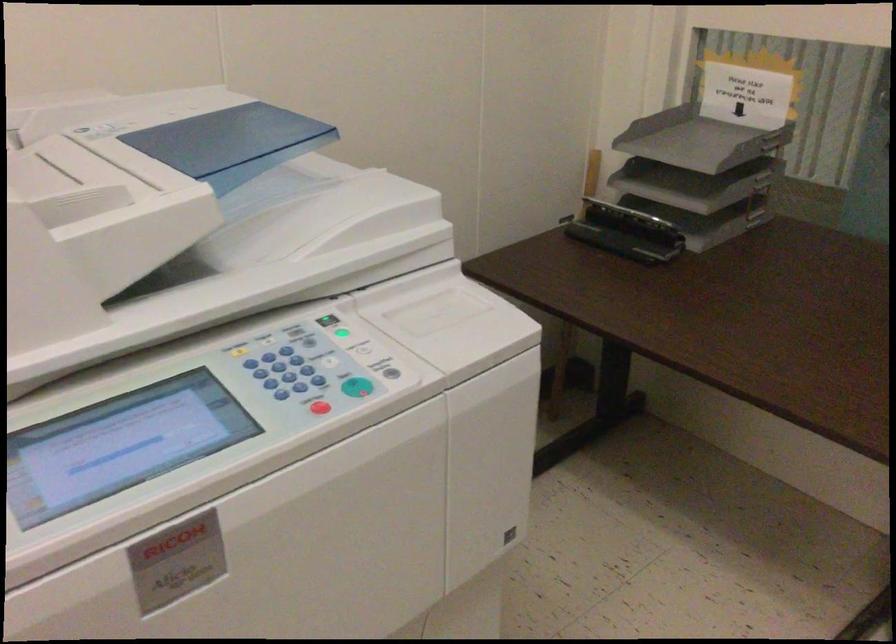
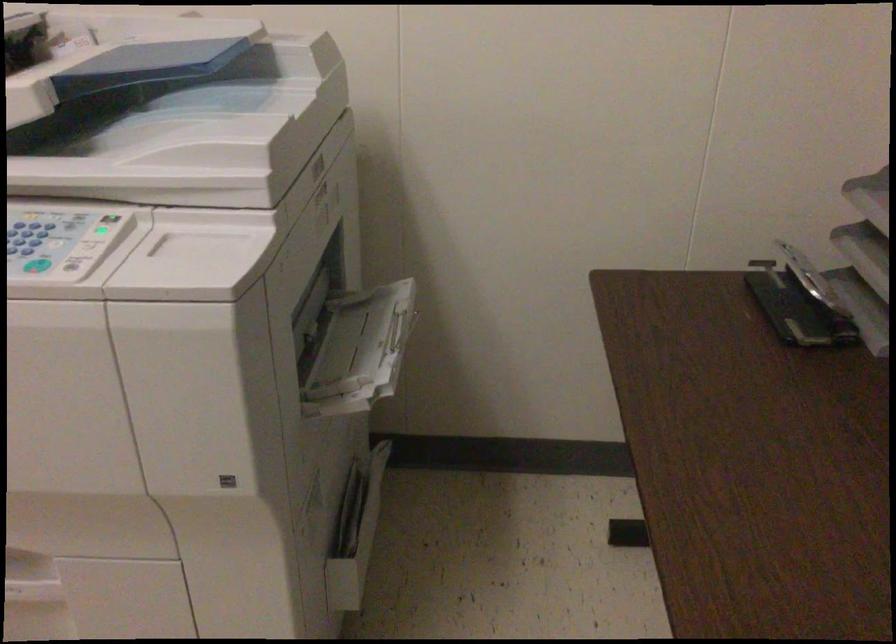
The point at (332, 333) is marked in the first image. Where is the corresponding point in the second image?

(107, 228)